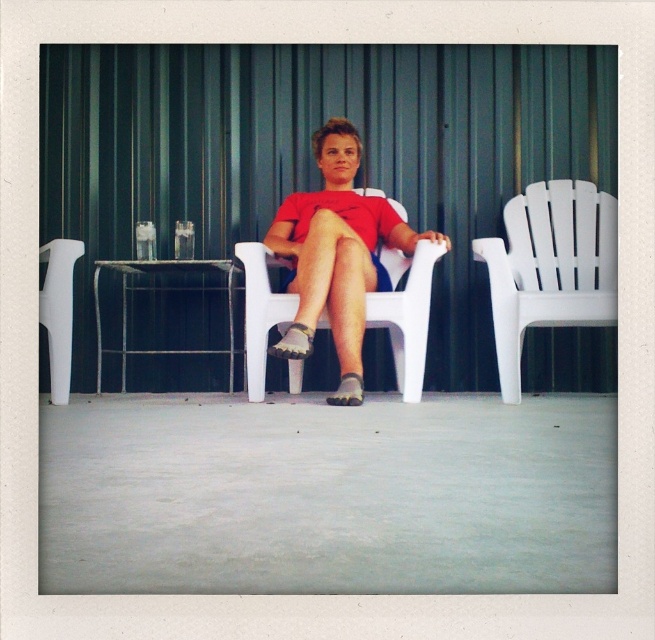
Does white plastic chair at center appear over white plastic chair at left?

No.

Between white plastic chair at center and white plastic chair at left, which one is positioned higher?

white plastic chair at left

Is point (265, 296) more distant than point (64, 349)?

No, (265, 296) is in front of (64, 349).

Locate an element on the screen. The image size is (655, 640). white plastic chair at center is located at coordinates (405, 314).

Does white plastic chair at right have a greater width compared to white plastic chair at center?

In fact, white plastic chair at right might be narrower than white plastic chair at center.

Who is more forward, (x=607, y=317) or (x=400, y=205)?

Positioned in front is point (x=607, y=317).

Find the location of a particular element. This screenshot has width=655, height=640. white plastic chair at right is located at coordinates (550, 268).

Which is in front, point (502, 364) or point (69, 336)?

Point (502, 364)

Does point (557, 269) come in front of point (48, 301)?

That is False.

Locate an element on the screen. white plastic chair at right is located at coordinates click(x=550, y=268).